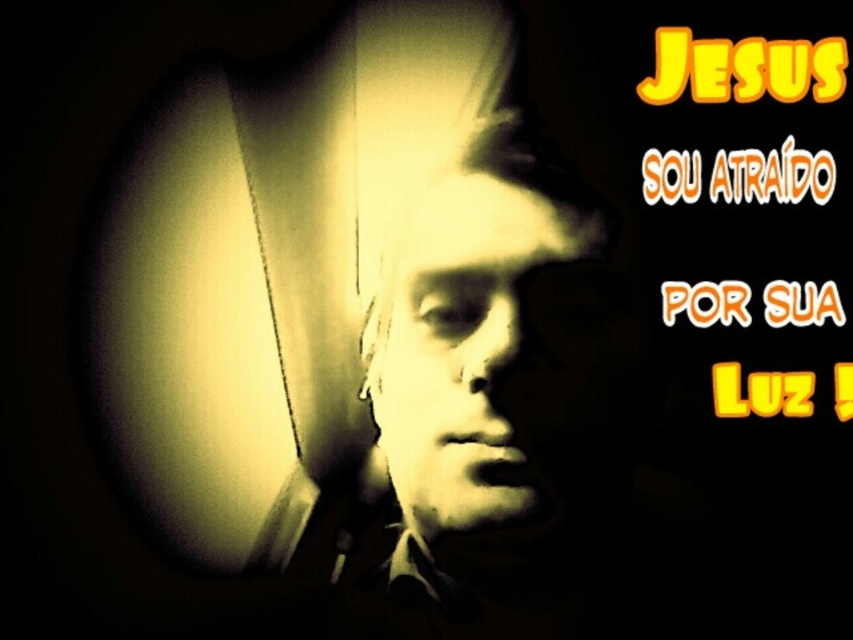
Question: Among these objects, which one is nearest to the camera?

Choices:
 (A) yellow glowing text at upper right
 (B) matte yellow face at center
 (C) matte black face at center
 (D) orangematerial/texturesou atraído at upper center

Answer: (D)

Question: Which of these objects is positioned closest to the matte yellow face at center?

Choices:
 (A) orangematerial/texturesou atraído at upper center
 (B) matte black face at center
 (C) yellow glowing text at upper right

Answer: (B)

Question: Is matte black face at center wider than yellow glowing text at upper right?

Choices:
 (A) no
 (B) yes

Answer: (B)

Question: Which point appears closest to the camera in this image?

Choices:
 (A) (534, 228)
 (B) (798, 417)
 (C) (495, 468)
 (D) (819, 150)

Answer: (D)

Question: Does matte yellow face at center have a smaller size compared to orangematerial/texturesou atraído at upper center?

Choices:
 (A) no
 (B) yes

Answer: (A)

Question: Does matte yellow face at center appear on the left side of orangematerial/texturesou atraído at upper center?

Choices:
 (A) no
 (B) yes

Answer: (B)